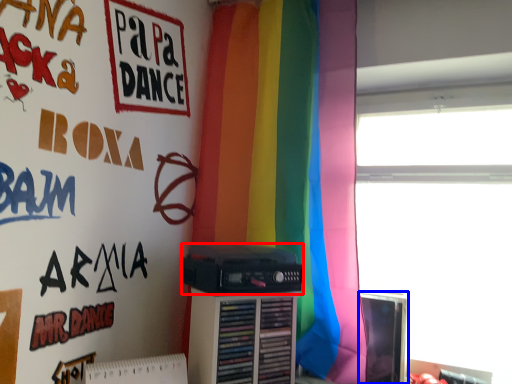
Question: Which point is closer to the camera, cassette (highlighted by a red box) or computer monitor (highlighted by a blue box)?

Choices:
 (A) cassette
 (B) computer monitor

Answer: (A)